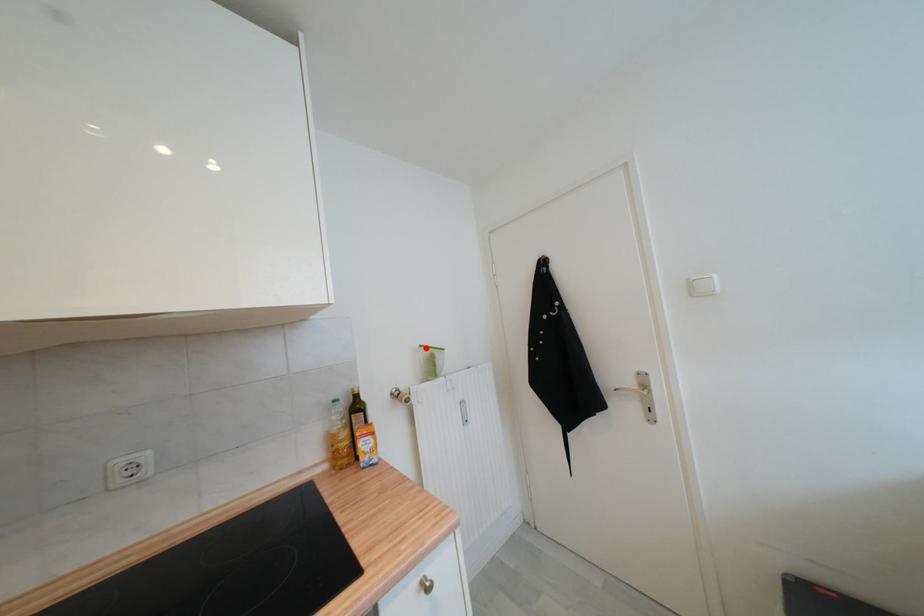
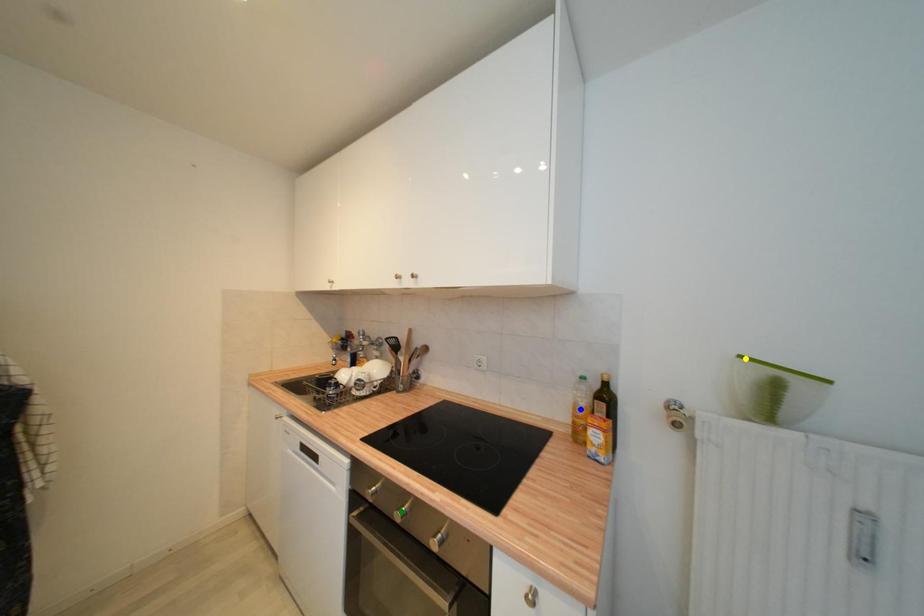
Question: I am providing you with two images of the same scene from different viewpoints. A red point is marked on the first image. You are given multiple points on the second image. Which mark in image 2 goes with the point in image 1?

Choices:
 (A) blue point
 (B) green point
 (C) yellow point

Answer: (C)